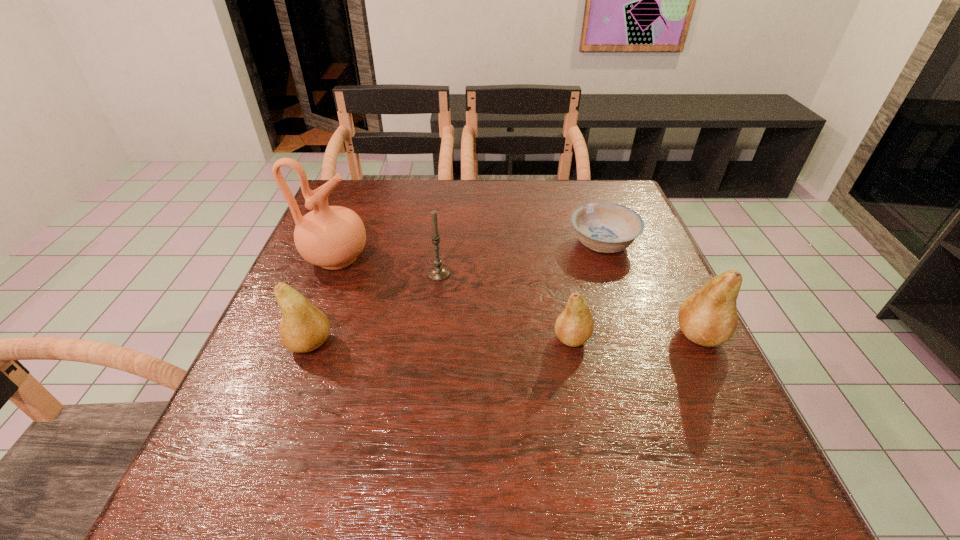
Identify the location of object that is the third closest one to the second pear from left to right. (437, 273).

Find the location of a particular element. The width and height of the screenshot is (960, 540). object identified as the closest to the candle is located at coordinates (332, 237).

Locate which pear is the second closest to the rightmost pear. Please provide its 2D coordinates. Your answer should be formatted as a tuple, i.e. [(x, y)], where the tuple contains the x and y coordinates of a point satisfying the conditions above.

[(303, 328)]

Point out which pear is positioned as the second nearest to the leftmost pear. Please provide its 2D coordinates. Your answer should be formatted as a tuple, i.e. [(x, y)], where the tuple contains the x and y coordinates of a point satisfying the conditions above.

[(708, 317)]

Locate an element on the screen. This screenshot has width=960, height=540. free point that satisfies the following two spatial constraints: 1. on the spout of the rightmost pear; 2. on the left side of the pottery is located at coordinates (306, 335).

This screenshot has width=960, height=540. I want to click on vacant area that satisfies the following two spatial constraints: 1. on the back side of the shortest pear; 2. on the left side of the rightmost pear, so click(x=571, y=335).

At what (x,y) coordinates should I click in order to perform the action: click on free space that satisfies the following two spatial constraints: 1. on the spout of the pottery; 2. on the back side of the third object from left to right. Please return your answer as a coordinate pair (x, y). Looking at the image, I should click on (330, 274).

You are a GUI agent. You are given a task and a screenshot of the screen. Output one action in this format:
    pyautogui.click(x=<x>, y=<y>)
    Task: Click on the vacant area in the image that satisfies the following two spatial constraints: 1. on the spout of the shortest pear; 2. on the right side of the pottery
    This screenshot has width=960, height=540.
    Given the screenshot: What is the action you would take?
    pyautogui.click(x=305, y=338)

At what (x,y) coordinates should I click in order to perform the action: click on vacant region that satisfies the following two spatial constraints: 1. on the spout of the tallest object; 2. on the right side of the second tallest pear. Please return your answer as a coordinate pair (x, y). This screenshot has width=960, height=540. Looking at the image, I should click on (303, 344).

Find the location of a particular element. This screenshot has width=960, height=540. free region that satisfies the following two spatial constraints: 1. on the back side of the second pear from right to left; 2. on the left side of the rightmost pear is located at coordinates (571, 335).